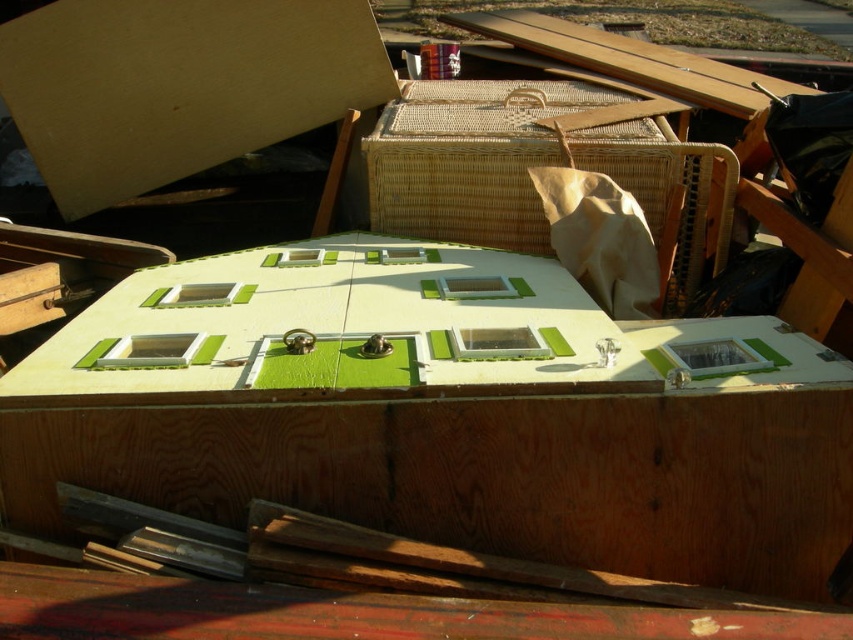
You are organizing items in a recycling area and see the matte cardboard at upper left and the woven rattan crate at center. Which item is closer to you?

The matte cardboard at upper left is closer to you than the woven rattan crate at center.

You are organizing items in a storage area and need to place the matte cardboard at upper left and the woven rattan crate at center. Which item takes up more space?

The woven rattan crate at center takes up more space than the matte cardboard at upper left because the matte cardboard at upper left occupies less space than woven rattan crate at center.

You are organizing items in a storage area and need to place a small package that is 30 inches long. You have a matte cardboard at upper left and a woven rattan crate at center. Can the package fit between them?

The distance between the matte cardboard at upper left and the woven rattan crate at center is 28.95 inches. Since the package is 30 inches long, it cannot fit between them as the space is shorter than the package.